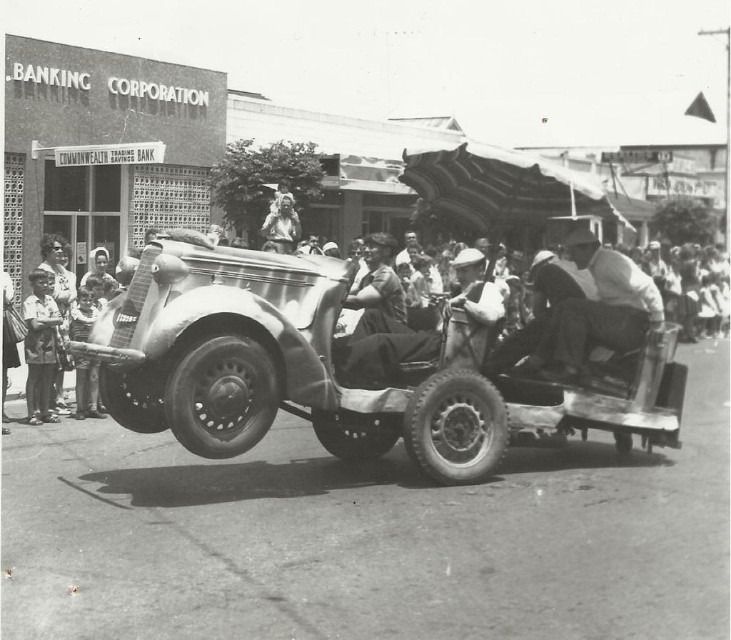
You are standing at the event and want to take a photo of the smooth leather jacket at center. If your camera can focus up to 7 meters, will you be able to capture a clear image?

The distance between the smooth leather jacket at center and the viewer is 6.98 meters, which is within the camera focus range of up to 7 meters. Therefore, you can capture a clear image.

You are a photographer at the event and want to take a photo of both the smooth leather jacket at center and the smooth fabric doll at center. However, you can only focus on one object at a time. Which object should you focus on to ensure the other is still visible in the background?

You should focus on the smooth leather jacket at center because it is in front of the smooth fabric doll at center, so the doll will be visible in the background.